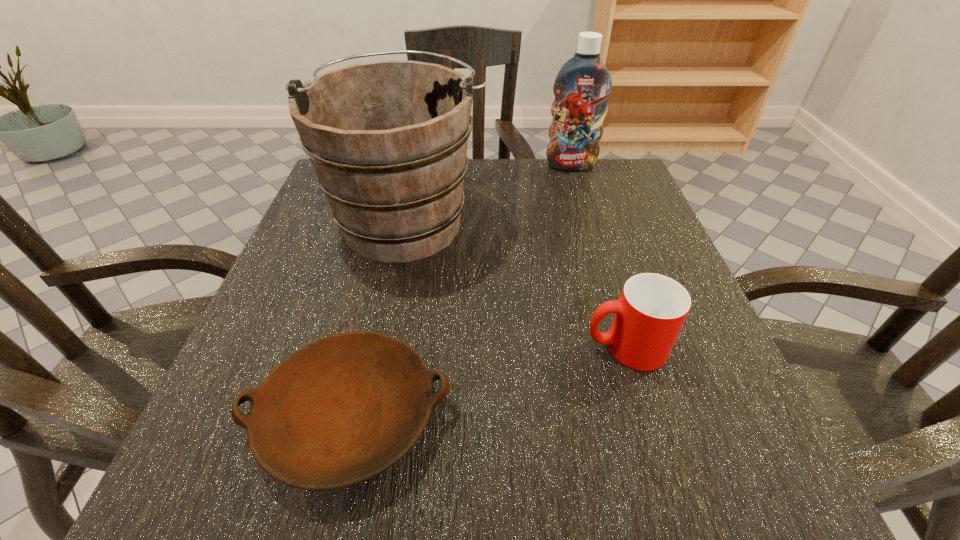
I want to click on free point between the shampoo and the second shortest object, so click(598, 256).

In order to click on vacant space in between the third nearest object and the farthest object in this screenshot , I will do `click(489, 193)`.

The image size is (960, 540). What are the coordinates of `empty space that is in between the shortest object and the cup` in the screenshot? It's located at (488, 382).

Identify the location of object that is the second nearest to the shortest object. (652, 308).

Where is `the third closest object relative to the shortest object`? This screenshot has width=960, height=540. the third closest object relative to the shortest object is located at coordinates (583, 84).